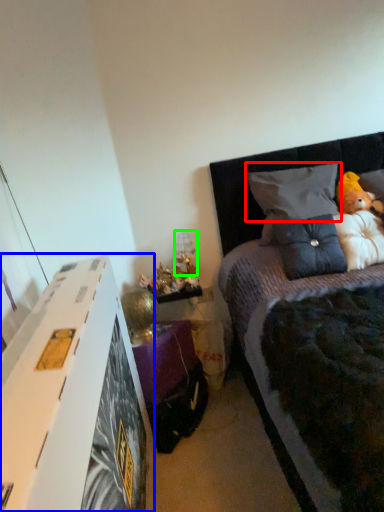
Question: Which object is positioned closest to pillow (highlighted by a red box)? Select from nightstand (highlighted by a blue box) and lamp (highlighted by a green box).

Choices:
 (A) nightstand
 (B) lamp

Answer: (B)